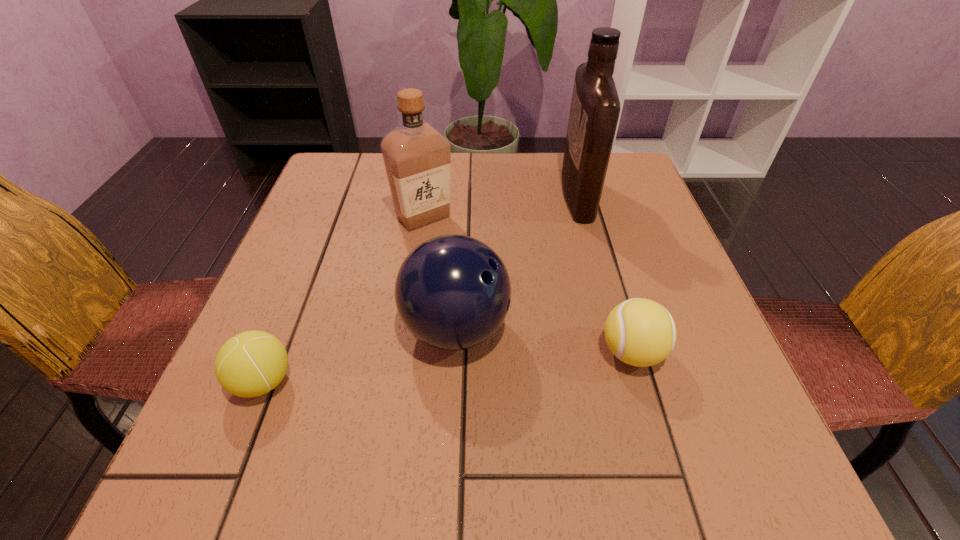
Locate an element on the screen. This screenshot has width=960, height=540. free location located on the front-facing side of the left liquor is located at coordinates (398, 382).

Where is `vacant space situated on the surface of the bowling ball near the finger holes`? The width and height of the screenshot is (960, 540). vacant space situated on the surface of the bowling ball near the finger holes is located at coordinates (615, 328).

Locate an element on the screen. The height and width of the screenshot is (540, 960). vacant area located 0.170m on the back of the right tennis ball is located at coordinates (605, 262).

Find the location of `vacant space located 0.060m on the back of the leftmost object`. vacant space located 0.060m on the back of the leftmost object is located at coordinates click(285, 328).

The image size is (960, 540). In order to click on object that is positioned at the left edge in this screenshot , I will do pyautogui.click(x=252, y=363).

Identify the location of liquor that is positioned at the right edge. This screenshot has height=540, width=960. (595, 107).

Where is `tennis ball that is at the right edge`? This screenshot has width=960, height=540. tennis ball that is at the right edge is located at coordinates (640, 332).

Locate an element on the screen. The image size is (960, 540). object situated at the far right corner is located at coordinates (595, 107).

This screenshot has width=960, height=540. In the image, there is a desktop. In order to click on free region at the far edge in this screenshot , I will do `click(459, 176)`.

In the image, there is a desktop. At what (x,y) coordinates should I click in order to perform the action: click on vacant space at the near edge. Please return your answer as a coordinate pair (x, y). The width and height of the screenshot is (960, 540). Looking at the image, I should click on (495, 484).